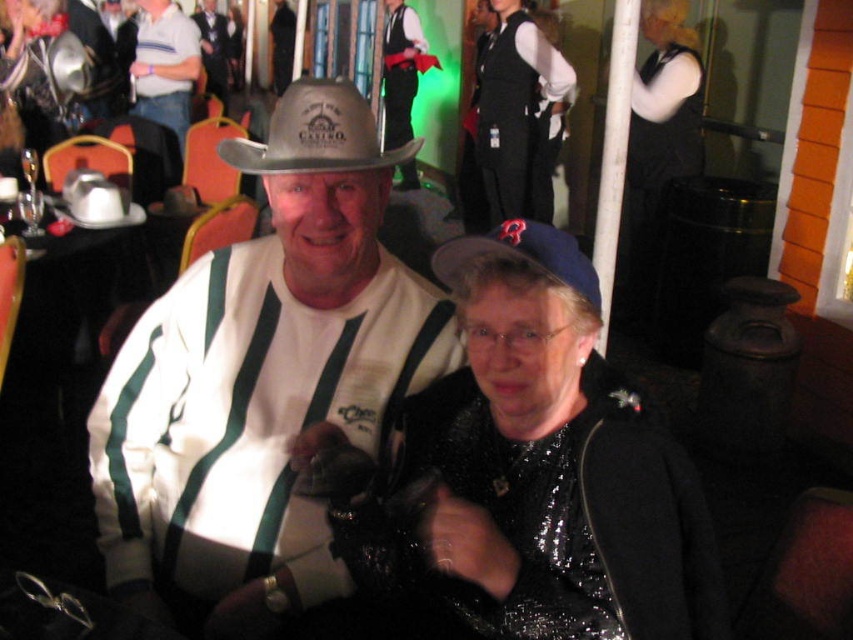
You are at a social gathering and want to locate two items in the image. The first is the white striped shirt at upper left and the second is the blue fabric cap at center. Which of these two items is positioned higher in the image?

The white striped shirt at upper left is positioned higher in the image than the blue fabric cap at center.